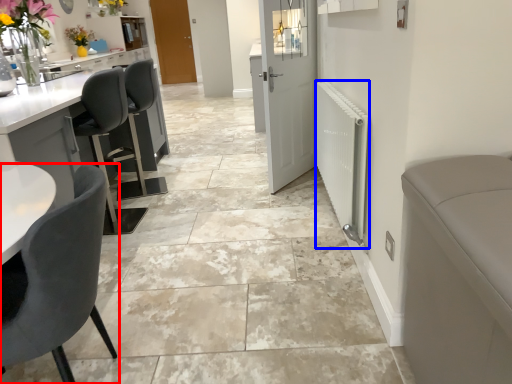
Question: Among these objects, which one is nearest to the camera, chair (highlighted by a red box) or radiator (highlighted by a blue box)?

Choices:
 (A) chair
 (B) radiator

Answer: (A)